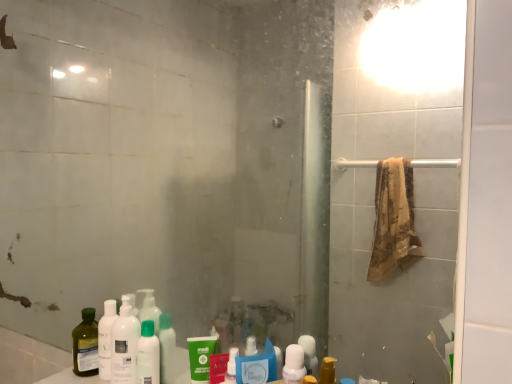
Question: Is white matte bottle at lower left shorter than white plastic bottle at lower center, the 1th mouthwash from the front?

Choices:
 (A) yes
 (B) no

Answer: (B)

Question: From a real-world perspective, is white matte bottle at lower left beneath white plastic bottle at lower center, marked as the 1th mouthwash in a right-to-left arrangement?

Choices:
 (A) no
 (B) yes

Answer: (A)

Question: Can you confirm if white matte bottle at lower left is smaller than white plastic bottle at lower center, which appears as the second mouthwash when viewed from the left?

Choices:
 (A) no
 (B) yes

Answer: (A)

Question: Is white matte bottle at lower left not near white plastic bottle at lower center, marked as the 1th mouthwash in a right-to-left arrangement?

Choices:
 (A) no
 (B) yes

Answer: (A)

Question: Does white matte bottle at lower left have a lesser width compared to white plastic bottle at lower center, marked as the second mouthwash in a back-to-front arrangement?

Choices:
 (A) no
 (B) yes

Answer: (A)

Question: From a real-world perspective, is white plastic bottle at lower center, which appears as the second mouthwash when viewed from the left, positioned above or below white matte bottle at lower left?

Choices:
 (A) below
 (B) above

Answer: (A)

Question: Is point (288, 357) closer or farther from the camera than point (123, 296)?

Choices:
 (A) farther
 (B) closer

Answer: (B)

Question: In terms of height, does white plastic bottle at lower center, which appears as the second mouthwash when viewed from the left, look taller or shorter compared to white matte bottle at lower left?

Choices:
 (A) short
 (B) tall

Answer: (A)

Question: Relative to white matte bottle at lower left, is white plastic bottle at lower center, marked as the 1th mouthwash in a right-to-left arrangement, in front or behind?

Choices:
 (A) behind
 (B) front

Answer: (B)

Question: From a real-world perspective, relative to white plastic bottle at lower center, which appears as the second mouthwash when viewed from the left, is white matte bottle at lower left vertically above or below?

Choices:
 (A) above
 (B) below

Answer: (A)

Question: Looking at their shapes, would you say white matte bottle at lower left is wider or thinner than white plastic bottle at lower center, which appears as the second mouthwash when viewed from the left?

Choices:
 (A) thin
 (B) wide

Answer: (B)

Question: Is white matte bottle at lower left situated inside white plastic bottle at lower center, marked as the second mouthwash in a back-to-front arrangement, or outside?

Choices:
 (A) outside
 (B) inside

Answer: (A)

Question: Considering the positions of white matte bottle at lower left and white plastic bottle at lower center, the 1th mouthwash from the front, in the image, is white matte bottle at lower left taller or shorter than white plastic bottle at lower center, the 1th mouthwash from the front,?

Choices:
 (A) short
 (B) tall

Answer: (B)

Question: Considering the relative positions of green matte bottle at center and white plastic bottle at lower center, which appears as the second mouthwash when viewed from the left, in the image provided, is green matte bottle at center to the left or to the right of white plastic bottle at lower center, which appears as the second mouthwash when viewed from the left,?

Choices:
 (A) left
 (B) right

Answer: (A)

Question: Relative to white plastic bottle at lower center, the 1th mouthwash from the front, is green matte bottle at center in front or behind?

Choices:
 (A) behind
 (B) front

Answer: (A)